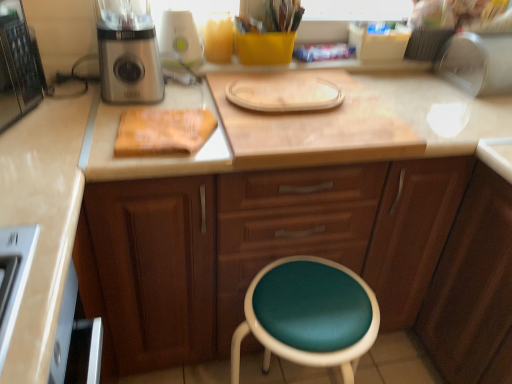
Question: From the image's perspective, is wooden cutting board at center located above white plastic blender at upper center, positioned as the 2th appliance in right-to-left order?

Choices:
 (A) no
 (B) yes

Answer: (A)

Question: Is wooden cutting board at center closer to the viewer compared to white plastic blender at upper center, positioned as the 2th appliance in right-to-left order?

Choices:
 (A) yes
 (B) no

Answer: (A)

Question: Does wooden cutting board at center turn towards white plastic blender at upper center, placed as the 1th appliance when sorted from left to right?

Choices:
 (A) no
 (B) yes

Answer: (A)

Question: Does wooden cutting board at center appear on the right side of white plastic blender at upper center, positioned as the 2th appliance in right-to-left order?

Choices:
 (A) no
 (B) yes

Answer: (B)

Question: Is wooden cutting board at center positioned beyond the bounds of white plastic blender at upper center, placed as the 1th appliance when sorted from left to right?

Choices:
 (A) yes
 (B) no

Answer: (A)

Question: In the image, is wooden cutting board at center on the left side or the right side of wooden cabinet at center?

Choices:
 (A) left
 (B) right

Answer: (B)

Question: Based on their sizes in the image, would you say wooden cutting board at center is bigger or smaller than wooden cabinet at center?

Choices:
 (A) big
 (B) small

Answer: (B)

Question: Does point (340, 74) appear closer or farther from the camera than point (394, 198)?

Choices:
 (A) farther
 (B) closer

Answer: (A)

Question: Considering their positions, is wooden cutting board at center located in front of or behind wooden cabinet at center?

Choices:
 (A) front
 (B) behind

Answer: (B)

Question: In the image, is white plastic blender at upper center, placed as the 1th appliance when sorted from left to right, positioned in front of or behind wooden cabinet at center?

Choices:
 (A) front
 (B) behind

Answer: (B)

Question: Is white plastic blender at upper center, placed as the 1th appliance when sorted from left to right, taller or shorter than wooden cabinet at center?

Choices:
 (A) short
 (B) tall

Answer: (A)

Question: From the image's perspective, is white plastic blender at upper center, positioned as the 2th appliance in right-to-left order, positioned above or below wooden cabinet at center?

Choices:
 (A) below
 (B) above

Answer: (B)

Question: Is white plastic blender at upper center, positioned as the 2th appliance in right-to-left order, bigger or smaller than wooden cabinet at center?

Choices:
 (A) big
 (B) small

Answer: (B)

Question: From the image's perspective, relative to teal leather stool at lower center, is wooden cutting board at center above or below?

Choices:
 (A) above
 (B) below

Answer: (A)

Question: In terms of size, does wooden cutting board at center appear bigger or smaller than teal leather stool at lower center?

Choices:
 (A) small
 (B) big

Answer: (A)